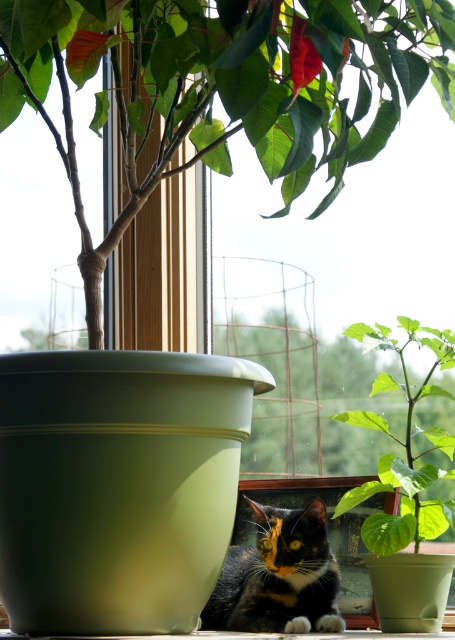
From the picture: Can you confirm if green matte plant at center is positioned below calico fur cat at center?

No.

Where is `green matte plant at center`? The image size is (455, 640). green matte plant at center is located at coordinates (222, 86).

Where is `green matte plant at center`? The image size is (455, 640). green matte plant at center is located at coordinates (222, 86).

Can you confirm if green matte plant at center is bigger than green leafy plant at center?

Yes, green matte plant at center is bigger than green leafy plant at center.

Between green matte plant at center and green leafy plant at center, which one appears on the left side from the viewer's perspective?

Positioned to the left is green matte plant at center.

Describe the element at coordinates (222, 86) in the screenshot. I see `green matte plant at center` at that location.

The image size is (455, 640). Identify the location of green matte plant at center. (222, 86).

Which is below, calico fur cat at center or green leafy plant at center?

calico fur cat at center is below.

Does calico fur cat at center have a smaller size compared to green leafy plant at center?

No, calico fur cat at center is not smaller than green leafy plant at center.

The image size is (455, 640). In order to click on calico fur cat at center in this screenshot , I will do `click(278, 577)`.